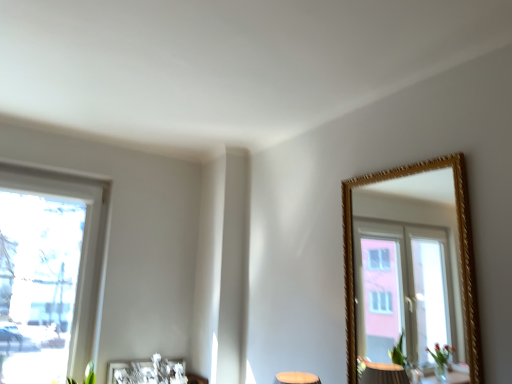
Find the location of a particular element. The height and width of the screenshot is (384, 512). white plastic window at left is located at coordinates (48, 273).

What do you see at coordinates (48, 273) in the screenshot?
I see `white plastic window at left` at bounding box center [48, 273].

Describe the element at coordinates (148, 371) in the screenshot. This screenshot has width=512, height=384. I see `metallic silver picture frame at lower center` at that location.

Where is `metallic silver picture frame at lower center`? The image size is (512, 384). metallic silver picture frame at lower center is located at coordinates (148, 371).

You are a GUI agent. You are given a task and a screenshot of the screen. Output one action in this format:
    pyautogui.click(x=<x>, y=<y>)
    Task: Click on the white plastic window at left
    The height and width of the screenshot is (384, 512).
    Given the screenshot: What is the action you would take?
    pyautogui.click(x=48, y=273)

Between white plastic window at left and metallic silver picture frame at lower center, which one appears on the right side from the viewer's perspective?

metallic silver picture frame at lower center is more to the right.

In the image, is white plastic window at left positioned in front of or behind metallic silver picture frame at lower center?

white plastic window at left is in front of metallic silver picture frame at lower center.

Considering the positions of points (63, 218) and (181, 360), is point (63, 218) farther from camera compared to point (181, 360)?

That is False.

From the image's perspective, is white plastic window at left located beneath metallic silver picture frame at lower center?

No.

From a real-world perspective, who is located lower, white plastic window at left or metallic silver picture frame at lower center?

metallic silver picture frame at lower center, from a real-world perspective.

Can you confirm if white plastic window at left is wider than metallic silver picture frame at lower center?

Yes, white plastic window at left is wider than metallic silver picture frame at lower center.

From the picture: Who is shorter, white plastic window at left or metallic silver picture frame at lower center?

With less height is metallic silver picture frame at lower center.

Does white plastic window at left have a larger size compared to metallic silver picture frame at lower center?

Correct, white plastic window at left is larger in size than metallic silver picture frame at lower center.

Is white plastic window at left not inside metallic silver picture frame at lower center?

Yes, white plastic window at left is outside of metallic silver picture frame at lower center.

Is white plastic window at left next to metallic silver picture frame at lower center?

No, white plastic window at left is not in contact with metallic silver picture frame at lower center.

Is white plastic window at left oriented towards metallic silver picture frame at lower center?

No, white plastic window at left is not facing towards metallic silver picture frame at lower center.

From the picture: How much distance is there between white plastic window at left and metallic silver picture frame at lower center?

white plastic window at left is 23.84 inches from metallic silver picture frame at lower center.

Where is `picture frame located on the right of white plastic window at left`? picture frame located on the right of white plastic window at left is located at coordinates (148, 371).

In the scene shown: Considering the relative positions of metallic silver picture frame at lower center and white plastic window at left in the image provided, is metallic silver picture frame at lower center to the left of white plastic window at left from the viewer's perspective?

No, metallic silver picture frame at lower center is not to the left of white plastic window at left.

Which is behind, metallic silver picture frame at lower center or white plastic window at left?

metallic silver picture frame at lower center is more distant.

Which is in front, point (170, 383) or point (82, 288)?

Point (170, 383)

From the image's perspective, relative to white plastic window at left, is metallic silver picture frame at lower center above or below?

Based on their image positions, metallic silver picture frame at lower center is located beneath white plastic window at left.

From a real-world perspective, which is physically above, metallic silver picture frame at lower center or white plastic window at left?

white plastic window at left.

Between metallic silver picture frame at lower center and white plastic window at left, which one has larger width?

white plastic window at left is wider.

Considering the relative sizes of metallic silver picture frame at lower center and white plastic window at left in the image provided, is metallic silver picture frame at lower center shorter than white plastic window at left?

Yes, metallic silver picture frame at lower center is shorter than white plastic window at left.

Between metallic silver picture frame at lower center and white plastic window at left, which one has smaller size?

metallic silver picture frame at lower center is smaller.

Is metallic silver picture frame at lower center located outside white plastic window at left?

Absolutely, metallic silver picture frame at lower center is external to white plastic window at left.

Is metallic silver picture frame at lower center not close to white plastic window at left?

No, there isn't a large distance between metallic silver picture frame at lower center and white plastic window at left.

Is metallic silver picture frame at lower center facing towards white plastic window at left?

No, metallic silver picture frame at lower center is not facing towards white plastic window at left.

How many degrees apart are the facing directions of metallic silver picture frame at lower center and white plastic window at left?

0.478 degrees separate the facing orientations of metallic silver picture frame at lower center and white plastic window at left.

Measure the distance between metallic silver picture frame at lower center and white plastic window at left.

metallic silver picture frame at lower center and white plastic window at left are 23.84 inches apart.

This screenshot has height=384, width=512. Find the location of `picture frame behind the white plastic window at left`. picture frame behind the white plastic window at left is located at coordinates (148, 371).

Find the location of a particular element. Image resolution: width=512 pixels, height=384 pixels. picture frame below the white plastic window at left (from a real-world perspective) is located at coordinates (148, 371).

Identify the location of window that appears in front of the metallic silver picture frame at lower center. (48, 273).